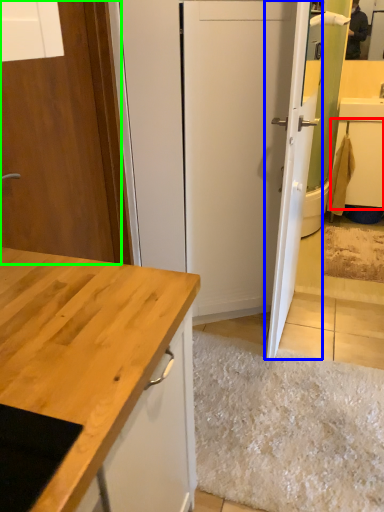
Question: Considering the real-world distances, which object is farthest from cabinetry (highlighted by a red box)? door (highlighted by a blue box) or door (highlighted by a green box)?

Choices:
 (A) door
 (B) door

Answer: (B)